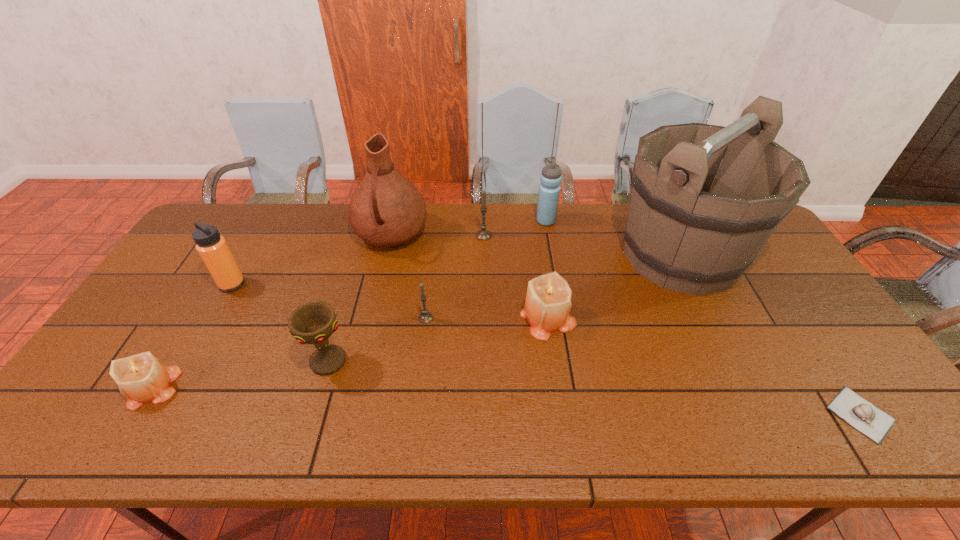
You are a GUI agent. You are given a task and a screenshot of the screen. Output one action in this format:
    pyautogui.click(x=<x>, y=<y>)
    Task: Click on the bucket positioned at the right edge
    This screenshot has height=540, width=960.
    Given the screenshot: What is the action you would take?
    [679, 234]

Locate an element on the screen. garlic that is at the right edge is located at coordinates (867, 418).

Where is `object present at the far right corner`? This screenshot has width=960, height=540. object present at the far right corner is located at coordinates (679, 234).

Find the location of a particular element. object that is at the near right corner is located at coordinates (867, 418).

Find the location of a particular element. vacant space at the far edge of the desktop is located at coordinates (251, 236).

The width and height of the screenshot is (960, 540). What are the coordinates of `blank space at the left edge of the desktop` in the screenshot? It's located at (141, 319).

Find the location of a particular element. free space at the right edge of the desktop is located at coordinates (793, 338).

You are a GUI agent. You are given a task and a screenshot of the screen. Output one action in this format:
    pyautogui.click(x=<x>, y=<y>)
    Task: Click on the empty space that is in between the right beige candle and the orange thermos bottle
    
    Given the screenshot: What is the action you would take?
    (x=390, y=300)

Find the location of a particular element. free space between the garlic and the pitcher is located at coordinates (626, 325).

Find the location of a particular element. The image size is (960, 540). free space between the third candle from left to right and the red chalice is located at coordinates (406, 298).